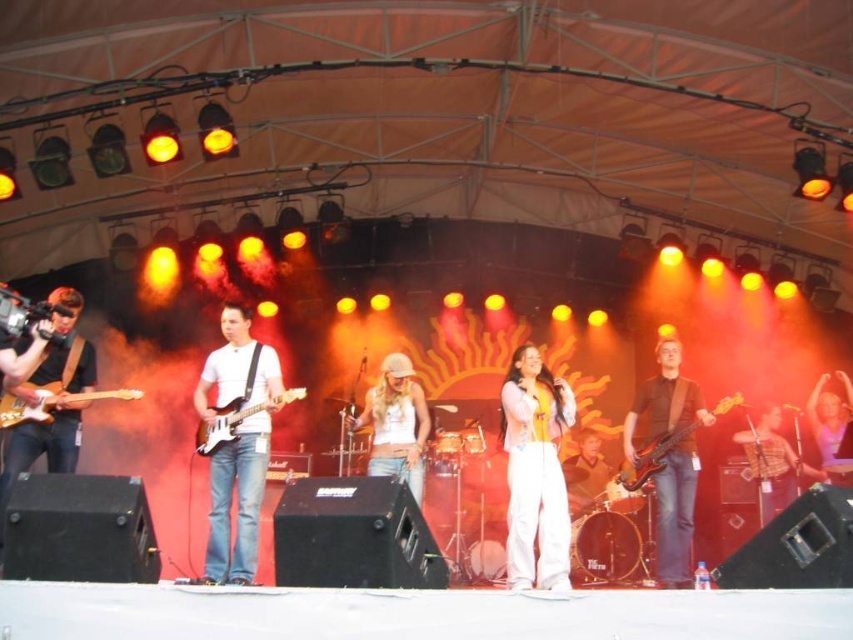
You are a stagehand who needs to adjust the lighting for the band. You see the matte white guitar at center and the shiny black electric guitar at center. Which guitar is closer to the front of the stage?

The matte white guitar at center is closer to the front of the stage because it is in front of the shiny black electric guitar at center.

You are a stagehand who needs to adjust the microphone stand between the metallic silver guitar at right and the light brown wood electric guitar at left. Which guitar should you approach first to reach the microphone stand without moving too far from your current position?

You should approach the metallic silver guitar at right first because it is closer to you than the light brown wood electric guitar at left, so you can reach the microphone stand near it with less movement.

You are a photographer standing at the camera position. You want to take a closeup shot of the white cotton pants at center. Given that your telephoto lens can focus on objects up to 5 meters away, will you be able to capture a clear image?

The distance between the white cotton pants at center and the camera is 5.67 meters, which exceeds the telephoto lens maximum focus range of 5 meters. Therefore, you won not be able to capture a clear image.